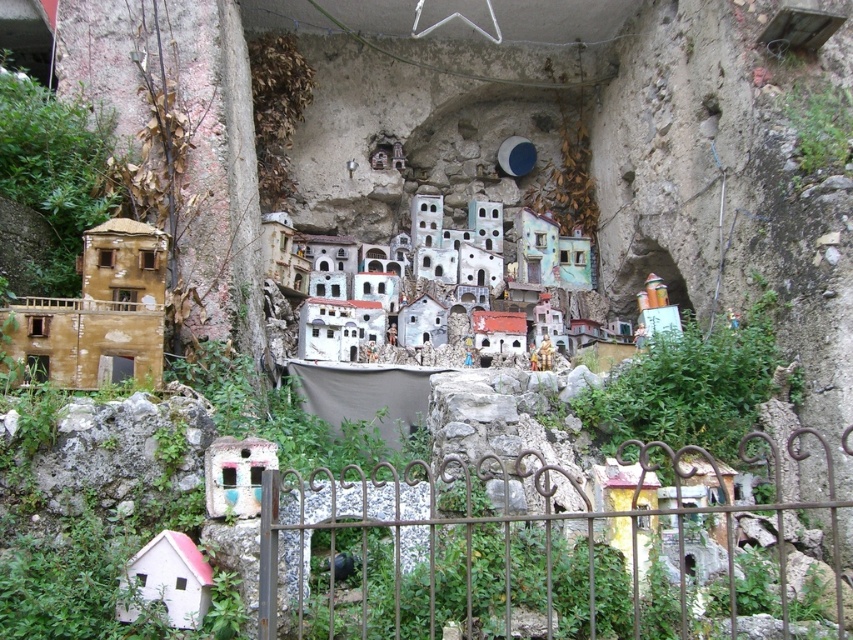
Question: Considering the real-world distances, which object is closest to the white matte house at lower center?

Choices:
 (A) white painted clay houses at center
 (B) matte brown building at left

Answer: (B)

Question: Which object is the farthest from the matte brown building at left?

Choices:
 (A) white matte house at lower center
 (B) brown wrought iron fence at lower center

Answer: (B)

Question: Can you confirm if white painted clay houses at center is positioned above matte brown building at left?

Choices:
 (A) yes
 (B) no

Answer: (A)

Question: Can you confirm if brown wrought iron fence at lower center is positioned below white painted clay houses at center?

Choices:
 (A) no
 (B) yes

Answer: (B)

Question: Based on their relative distances, which object is nearer to the white matte house at lower center?

Choices:
 (A) white painted clay houses at center
 (B) brown wrought iron fence at lower center
 (C) matte brown building at left

Answer: (C)

Question: Can you confirm if white painted clay houses at center is positioned below matte brown building at left?

Choices:
 (A) yes
 (B) no

Answer: (B)